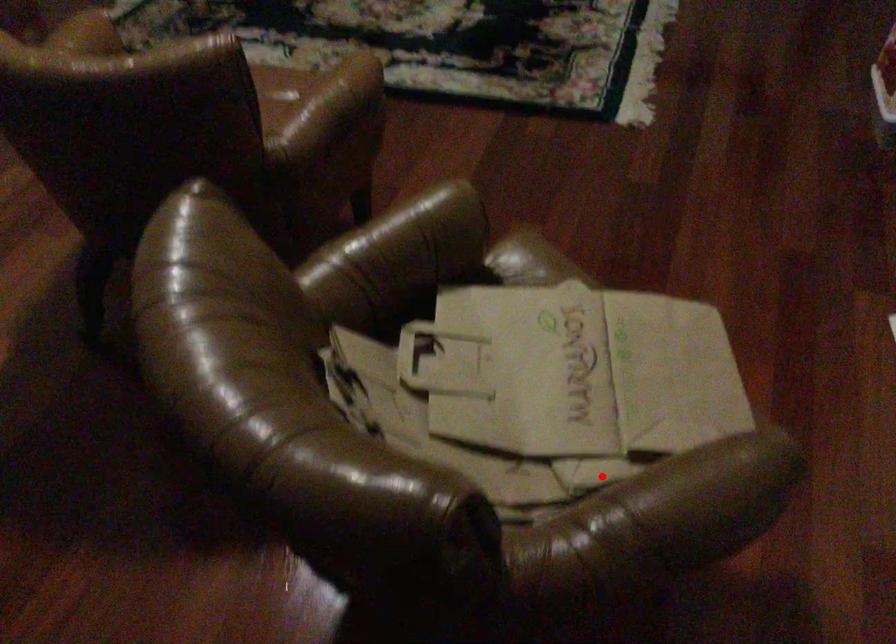
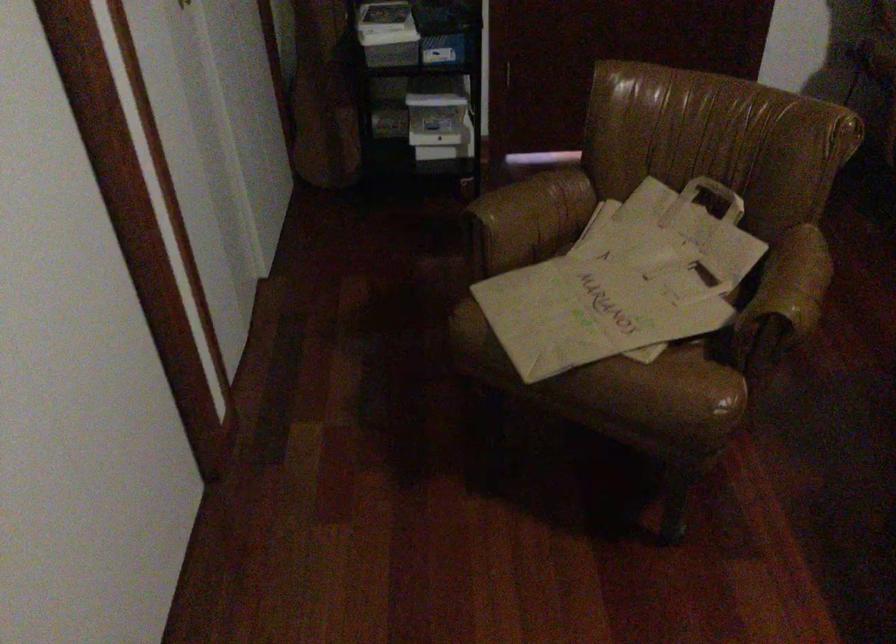
Question: I am providing you with two images of the same scene from different viewpoints. In image1, a red point is highlighted. Considering the same 3D point in image2, which of the following is correct?

Choices:
 (A) It is closer
 (B) It is farther

Answer: (B)